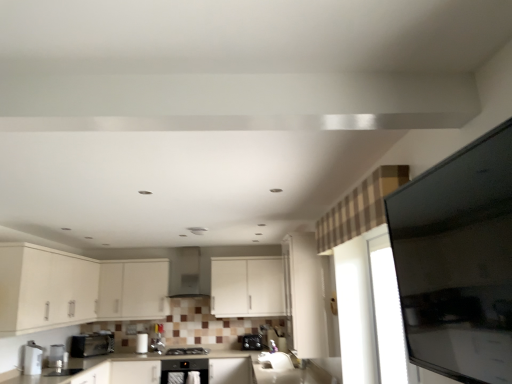
Question: Does point (138, 347) appear closer or farther from the camera than point (259, 344)?

Choices:
 (A) farther
 (B) closer

Answer: (B)

Question: Is white glossy toaster at lower center, arranged as the third appliance when viewed from the back, to the left or to the right of satin black toaster at lower center, the fourth appliance viewed from the left, in the image?

Choices:
 (A) right
 (B) left

Answer: (B)

Question: Estimate the real-world distances between objects in this image. Which object is closer to the satin silver exhaust hood at center?

Choices:
 (A) matte white cabinet at center, which is the second cabinetry from left to right
 (B) satin black toaster at lower center, marked as the fourth appliance in a front-to-back arrangement
 (C) transparent glass door at right
 (D) satin silver faucet at lower left, the 5th appliance when ordered from back to front
 (E) white glossy countertop at lower center

Answer: (A)

Question: Which object is positioned farthest from the matte white cabinets at lower left, acting as the first cabinetry starting from the left?

Choices:
 (A) white glossy toaster at lower center, marked as the 3th appliance in a right-to-left arrangement
 (B) satin black microwave at lower left, which is counted as the second home appliance, starting from the bottom
 (C) matte white cabinet at center, which is the second cabinetry from left to right
 (D) white glossy countertop at lower center
 (E) satin silver exhaust hood at center

Answer: (D)